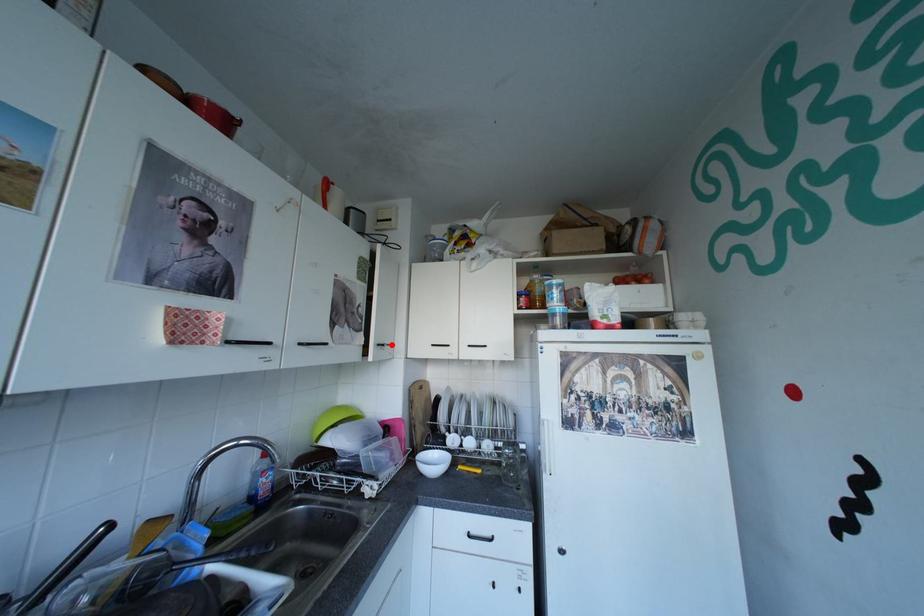
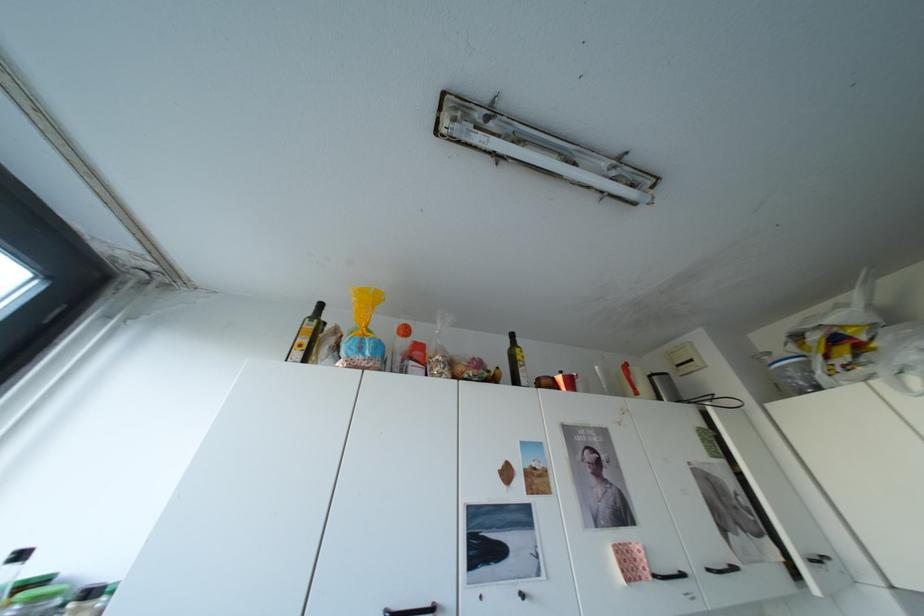
Locate, in the second image, the point that corresponds to the highlighted location in the first image.

(824, 561)